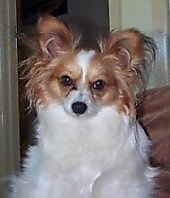
Image resolution: width=170 pixels, height=198 pixels. In order to click on white chest in this screenshot , I will do `click(104, 132)`.